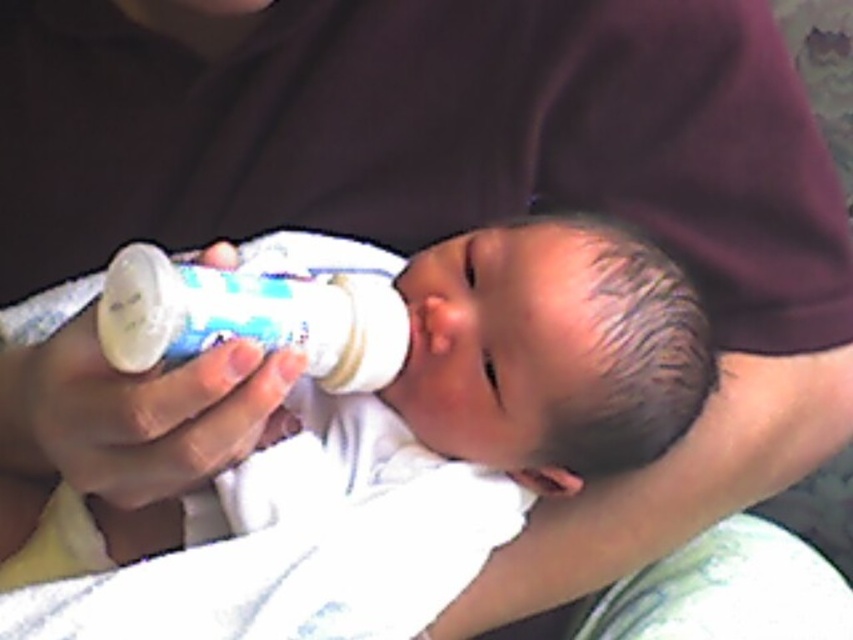
In the scene shown: You are a caregiver holding two bottles for a newborn. One is a white soft baby bottle at center and the other is a white plastic baby bottle at center. Which bottle should you choose if you need the larger one for feeding?

You should choose the white soft baby bottle at center because it is bigger than the white plastic baby bottle at center.

You are a caregiver holding a baby wrapped in a white blanket. You have two bottles in front of you. One is a white soft baby bottle at center and the other is a white plastic baby bottle at center. The baby is facing towards you. Which bottle is closer to the baby?

The white soft baby bottle at center is closer to the baby because the white plastic baby bottle at center is behind it.

You are a caregiver holding a baby and need to place the white soft baby bottle at center in a specific location. According to the image, where exactly should you position the bottle relative to the baby?

The white soft baby bottle at center should be positioned at point 0.614 on the x axis and 0.535 on the y axis relative to the baby.